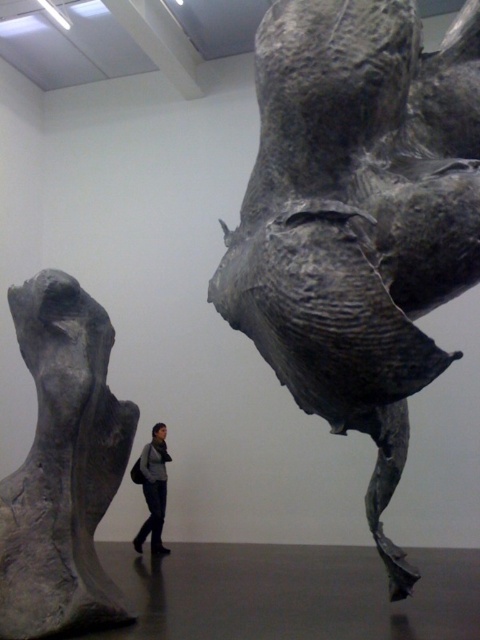
Question: Which object is closer to the camera taking this photo?

Choices:
 (A) gray textured sculpture at upper right
 (B) dark gray fabric jacket at center

Answer: (A)

Question: Observing the image, what is the correct spatial positioning of gray textured sculpture at upper right in reference to dark gray fabric jacket at center?

Choices:
 (A) below
 (B) above

Answer: (B)

Question: Which object appears closest to the camera in this image?

Choices:
 (A) gray textured sculpture at upper right
 (B) gray matte sculpture at left
 (C) dark gray fabric jacket at center

Answer: (A)

Question: Can you confirm if gray textured sculpture at upper right is positioned to the left of dark gray fabric jacket at center?

Choices:
 (A) yes
 (B) no

Answer: (B)

Question: Among these objects, which one is farthest from the camera?

Choices:
 (A) gray textured sculpture at upper right
 (B) gray matte sculpture at left

Answer: (B)

Question: Can you confirm if gray textured sculpture at upper right is positioned to the right of dark gray fabric jacket at center?

Choices:
 (A) yes
 (B) no

Answer: (A)